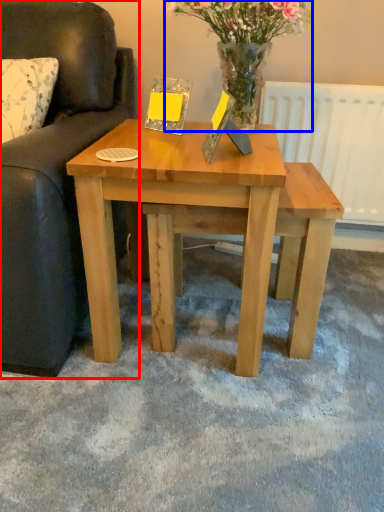
Question: Which object appears farthest to the camera in this image, studio couch (highlighted by a red box) or floral arrangement (highlighted by a blue box)?

Choices:
 (A) studio couch
 (B) floral arrangement

Answer: (B)